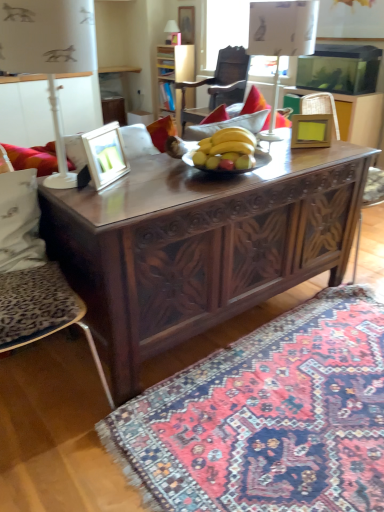
The height and width of the screenshot is (512, 384). I want to click on free region under white plastic lamp at left, which ranks as the third lamp in top-to-bottom order (from a real-world perspective), so click(x=69, y=182).